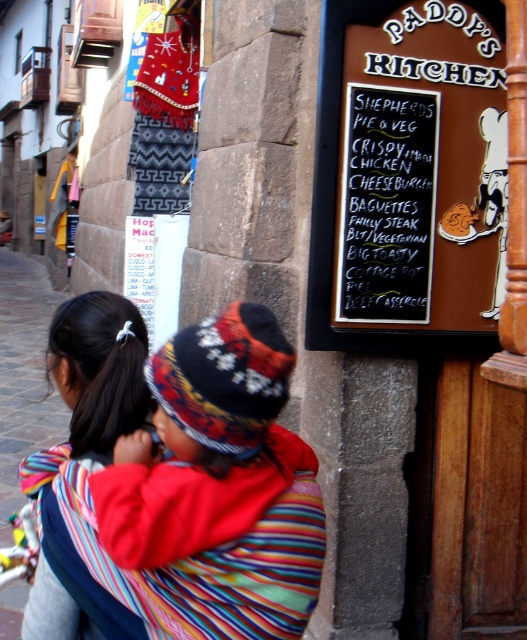
You are a delivery person who needs to place a package on the multicolored woven fabric at center and then retrieve a note from the brown chalkboard at upper right. Given the distance between them, can you do both tasks without moving more than 5 feet from your starting position?

The multicolored woven fabric at center and brown chalkboard at upper right are 4.54 feet apart. Since the distance is less than 5 feet, you can reach both items without moving more than 5 feet from your starting position.

You are a delivery person who needs to attach a package to the multicolored woven cloth at center and the brown chalkboard at upper right. Which object has enough space to securely attach the package?

The brown chalkboard at upper right has a greater width than the multicolored woven cloth at center, so it can securely attach the package.